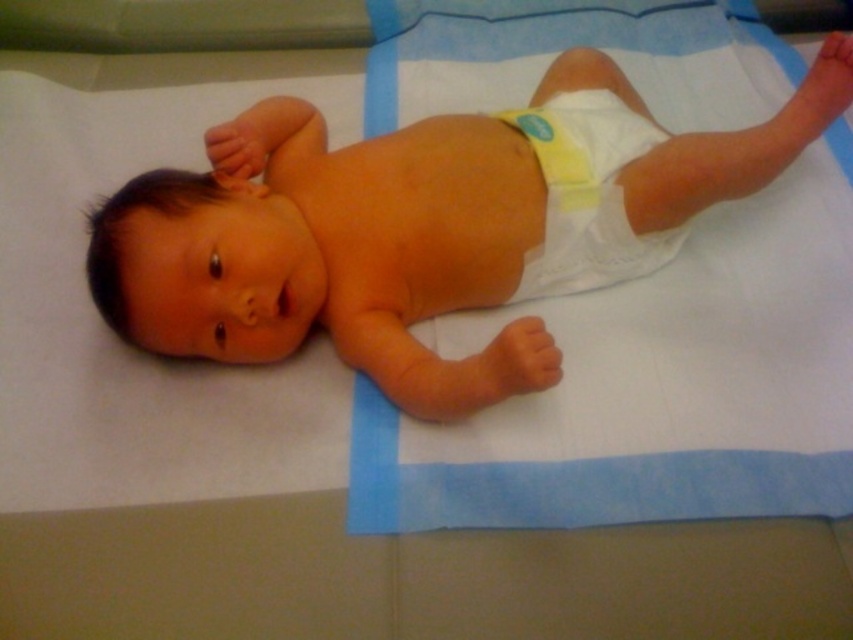
Question: Which point appears closest to the camera in this image?

Choices:
 (A) (612, 129)
 (B) (253, 316)

Answer: (B)

Question: Which point is closer to the camera?

Choices:
 (A) white cloth diaper at center
 (B) smooth skin baby at center

Answer: (B)

Question: Which point is farther from the camera taking this photo?

Choices:
 (A) (611, 212)
 (B) (476, 132)

Answer: (B)

Question: Does smooth skin baby at center have a larger size compared to white cloth diaper at center?

Choices:
 (A) yes
 (B) no

Answer: (A)

Question: Is smooth skin baby at center thinner than white cloth diaper at center?

Choices:
 (A) yes
 (B) no

Answer: (B)

Question: Does smooth skin baby at center appear on the right side of white cloth diaper at center?

Choices:
 (A) no
 (B) yes

Answer: (A)